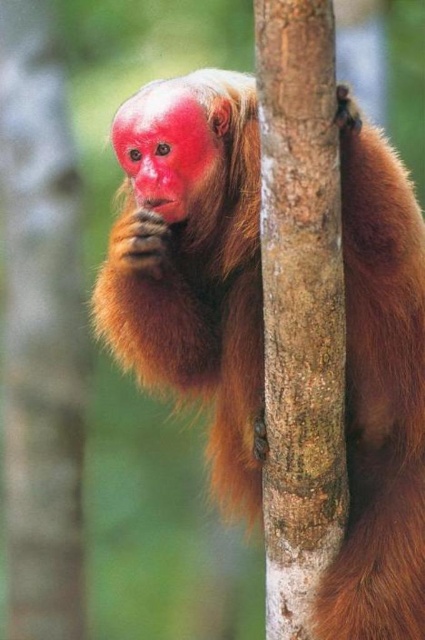
Between smooth pinkish-red face at center and pink matte nose at upper center, which one is positioned higher?

smooth pinkish-red face at center is higher up.

Does smooth pinkish-red face at center have a lesser width compared to pink matte nose at upper center?

In fact, smooth pinkish-red face at center might be wider than pink matte nose at upper center.

Identify the location of smooth pinkish-red face at center. (164, 147).

Is smooth brown bark at center to the right of pink matte nose at upper center from the viewer's perspective?

Yes, smooth brown bark at center is to the right of pink matte nose at upper center.

Which is more to the right, smooth brown bark at center or pink matte nose at upper center?

From the viewer's perspective, smooth brown bark at center appears more on the right side.

The width and height of the screenshot is (425, 640). What do you see at coordinates (300, 305) in the screenshot? I see `smooth brown bark at center` at bounding box center [300, 305].

Where is `smooth brown bark at center`? This screenshot has height=640, width=425. smooth brown bark at center is located at coordinates (300, 305).

From the picture: Between smooth brown bark at center and smooth pinkish-red face at center, which one has less height?

smooth pinkish-red face at center

At what (x,y) coordinates should I click in order to perform the action: click on smooth brown bark at center. Please return your answer as a coordinate pair (x, y). The width and height of the screenshot is (425, 640). Looking at the image, I should click on point(300,305).

Locate an element on the screen. smooth brown bark at center is located at coordinates (300, 305).